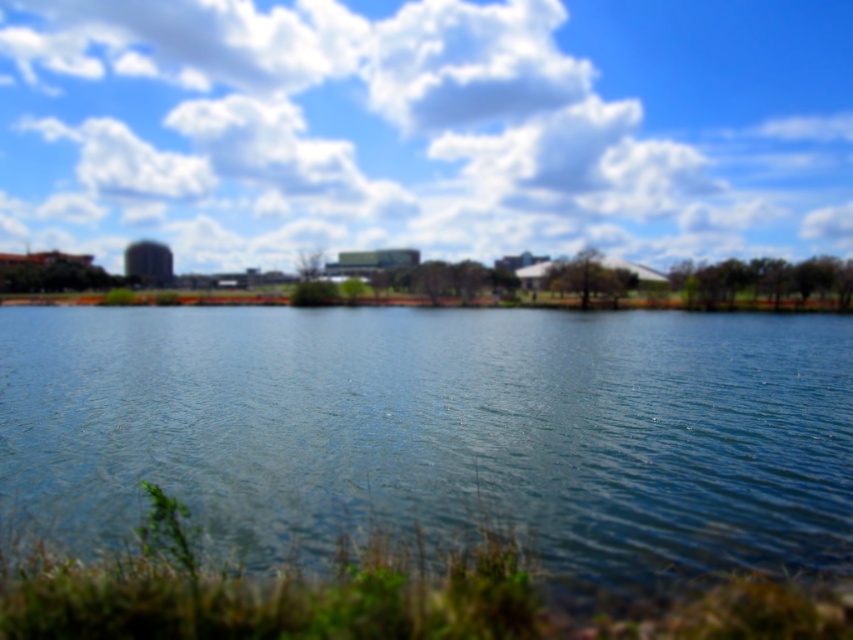
Question: Can you confirm if white fluffy cloud at upper center is smaller than clear water at center?

Choices:
 (A) yes
 (B) no

Answer: (B)

Question: Is the position of white fluffy cloud at upper center less distant than that of clear water at center?

Choices:
 (A) yes
 (B) no

Answer: (B)

Question: Which of the following is the farthest from the observer?

Choices:
 (A) white fluffy cloud at upper center
 (B) clear water at center

Answer: (A)

Question: Does white fluffy cloud at upper center have a smaller size compared to clear water at center?

Choices:
 (A) yes
 (B) no

Answer: (B)